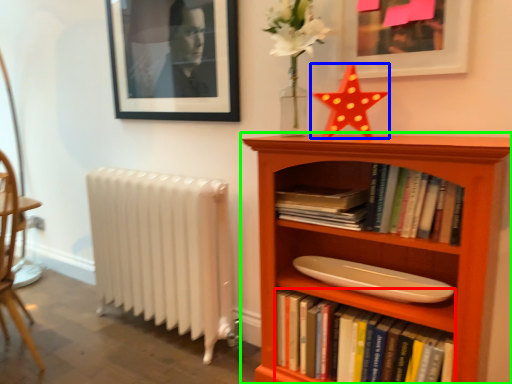
Question: Estimate the real-world distances between objects in this image. Which object is closer to book (highlighted by a red box), chiffonier (highlighted by a blue box) or bookcase (highlighted by a green box)?

Choices:
 (A) chiffonier
 (B) bookcase

Answer: (B)